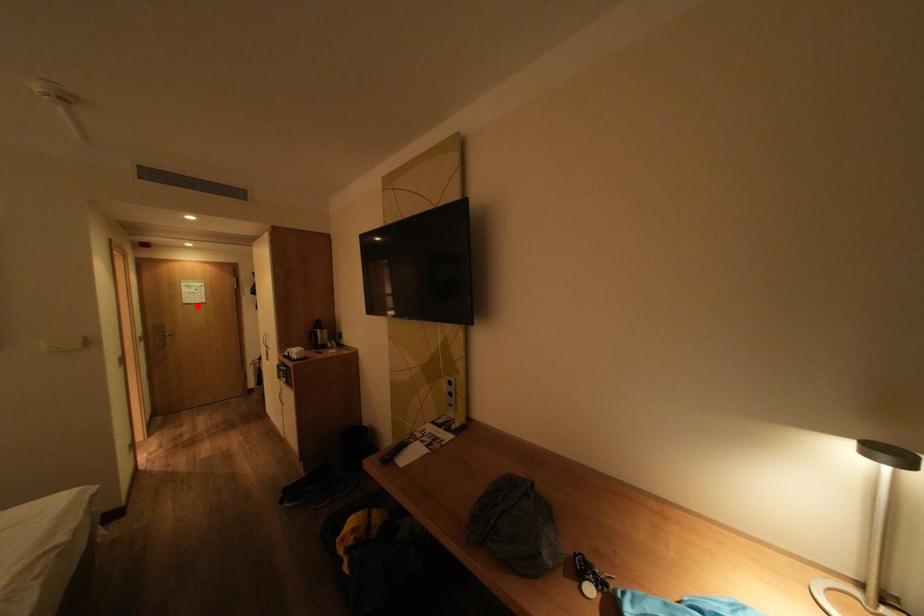
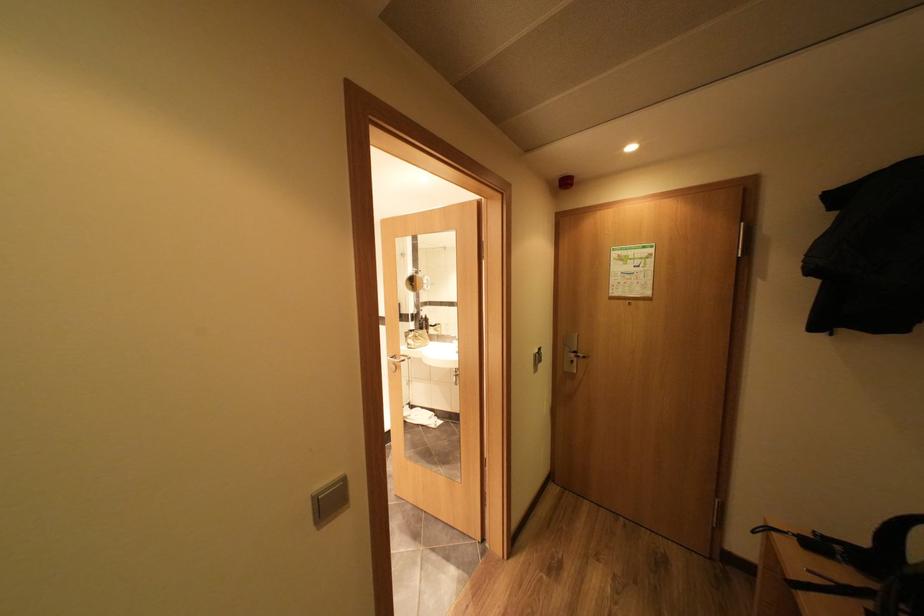
The point at the highlighted location is marked in the first image. Where is the corresponding point in the second image?

(626, 302)